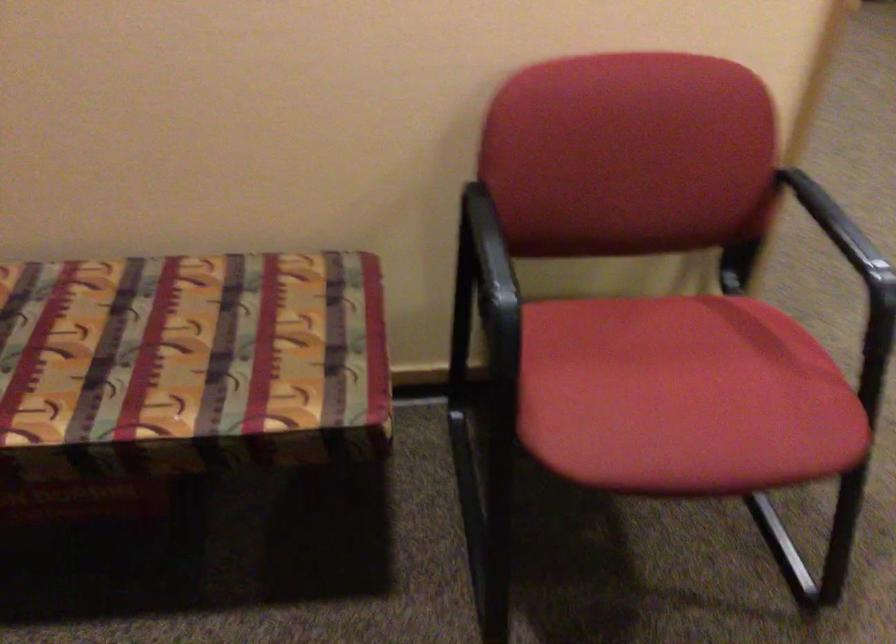
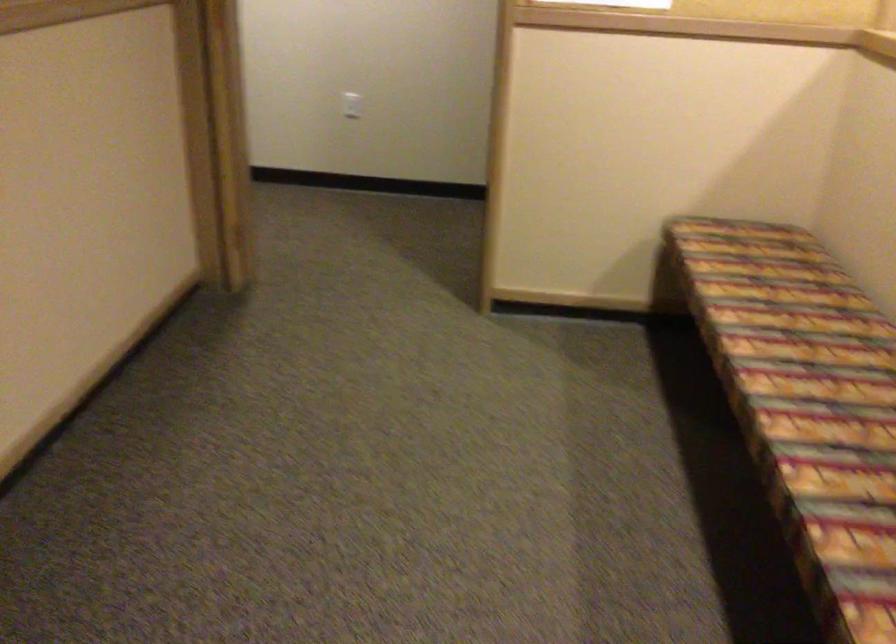
Consider the image. How did the camera likely rotate?

Result: The camera rotated toward left-down.